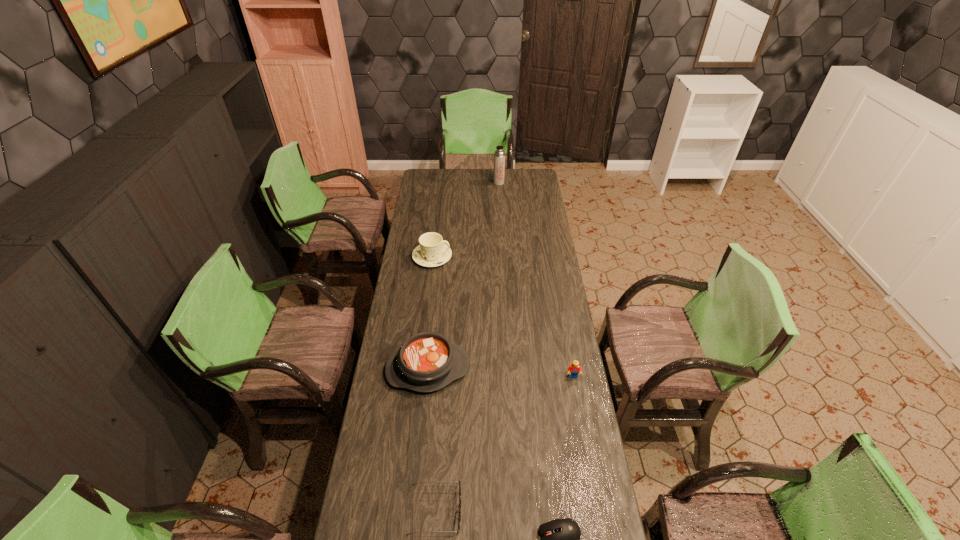
The height and width of the screenshot is (540, 960). Find the location of `the farthest object`. the farthest object is located at coordinates (499, 156).

I want to click on the tallest object, so click(x=499, y=156).

This screenshot has width=960, height=540. Identify the location of chinaware. (432, 252).

The width and height of the screenshot is (960, 540). Identify the location of casserole. point(426,362).

This screenshot has width=960, height=540. In order to click on the rightmost object in this screenshot , I will do [573, 370].

Locate an element on the screen. Image resolution: width=960 pixels, height=540 pixels. the fourth tallest object is located at coordinates (573, 370).

Find the location of a particular element. spectacles is located at coordinates (458, 511).

At what (x,y) coordinates should I click in order to perform the action: click on vacant region located on the front of the fourth object from left to right. Please return your answer as a coordinate pair (x, y). The width and height of the screenshot is (960, 540). Looking at the image, I should click on (500, 202).

At what (x,y) coordinates should I click in order to perform the action: click on vacant space located on the handle side of the fifth nearest object. Please return your answer as a coordinate pair (x, y). Image resolution: width=960 pixels, height=540 pixels. Looking at the image, I should click on (464, 257).

You are a GUI agent. You are given a task and a screenshot of the screen. Output one action in this format:
    pyautogui.click(x=<x>, y=<y>)
    Task: Click on the blank area located 0.100m on the right of the casserole
    
    Given the screenshot: What is the action you would take?
    pyautogui.click(x=495, y=369)